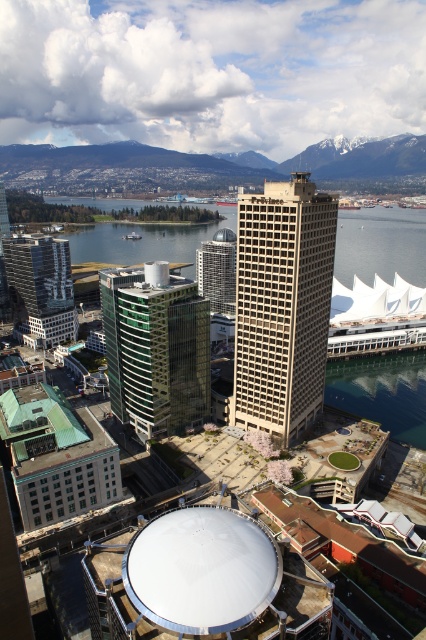
Who is higher up, clear blue water at center or glassy reflective skyscraper at left?

clear blue water at center is higher up.

Does clear blue water at center appear under glassy reflective skyscraper at left?

Actually, clear blue water at center is above glassy reflective skyscraper at left.

Is point (106, 224) positioned behind point (54, 316)?

Yes, it is.

The width and height of the screenshot is (426, 640). I want to click on clear blue water at center, so click(x=380, y=244).

Is the position of green glass building at center less distant than that of clear blue water at center?

Yes.

Who is more forward, (103, 304) or (414, 216)?

Positioned in front is point (103, 304).

You are a GUI agent. You are given a task and a screenshot of the screen. Output one action in this format:
    pyautogui.click(x=<x>, y=<y>)
    Task: Click on the green glass building at center
    This screenshot has height=640, width=426.
    Given the screenshot: What is the action you would take?
    pyautogui.click(x=155, y=348)

Does green glass building at center have a larger size compared to glassy reflective skyscraper at left?

Incorrect, green glass building at center is not larger than glassy reflective skyscraper at left.

Between green glass building at center and glassy reflective skyscraper at left, which one appears on the right side from the viewer's perspective?

Positioned to the right is green glass building at center.

Locate an element on the screen. This screenshot has width=426, height=640. green glass building at center is located at coordinates (155, 348).

Where is `green glass building at center`? The width and height of the screenshot is (426, 640). green glass building at center is located at coordinates [155, 348].